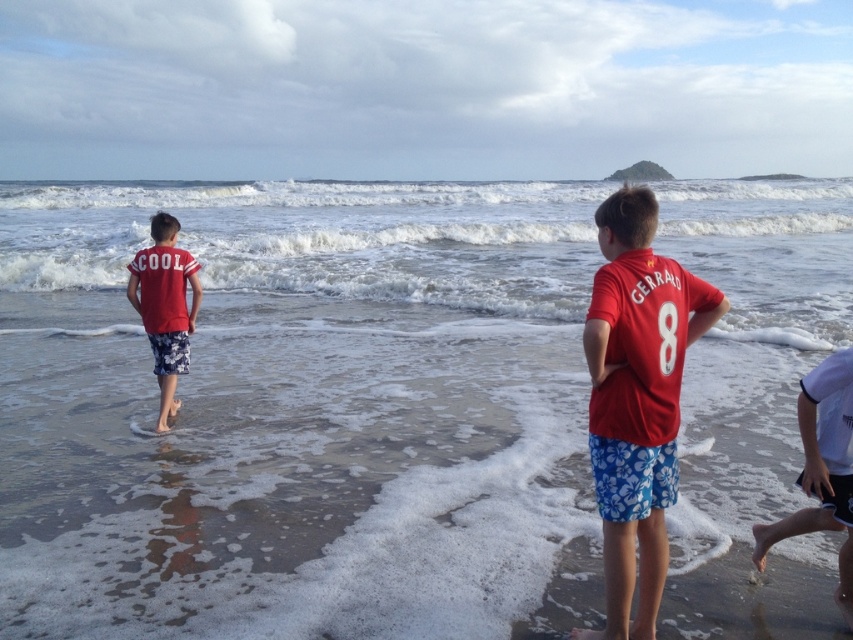
Does smooth sand beach at center have a lesser height compared to matte red t-shirt at left?

No.

Is point (438, 520) less distant than point (178, 257)?

Yes, point (438, 520) is closer to viewer.

Between point (491, 381) and point (134, 292), which one is positioned behind?

The point (491, 381) is more distant.

Where is `smooth sand beach at center`? Image resolution: width=853 pixels, height=640 pixels. smooth sand beach at center is located at coordinates (289, 465).

Who is taller, white foamy water at center or matte red t-shirt at left?

Standing taller between the two is white foamy water at center.

Who is positioned more to the left, white foamy water at center or matte red t-shirt at left?

white foamy water at center is more to the left.

Who is more distant from viewer, (289, 250) or (186, 317)?

The point (289, 250) is behind.

Identify the location of white foamy water at center. The width and height of the screenshot is (853, 640). (320, 241).

Does white foamy water at center appear on the right side of matte red t-shirt at center?

In fact, white foamy water at center is to the left of matte red t-shirt at center.

Who is higher up, white foamy water at center or matte red t-shirt at center?

Positioned higher is white foamy water at center.

What do you see at coordinates (320, 241) in the screenshot? I see `white foamy water at center` at bounding box center [320, 241].

In order to click on white foamy water at center in this screenshot , I will do `click(320, 241)`.